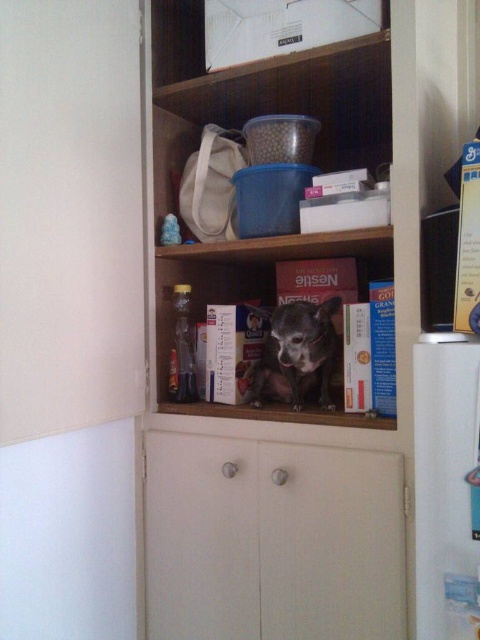
Question: Which object appears farthest from the camera in this image?

Choices:
 (A) wooden bookshelf at upper center
 (B) wooden shelf at center
 (C) fuzzy brown dog at center
 (D) white glossy refrigerator at right

Answer: (C)

Question: Which object appears farthest from the camera in this image?

Choices:
 (A) white glossy refrigerator at right
 (B) white matte cabinet at lower center

Answer: (B)

Question: From the image, what is the correct spatial relationship of white matte cabinet at lower center in relation to fuzzy brown dog at center?

Choices:
 (A) above
 (B) below

Answer: (B)

Question: Which object is farther from the camera taking this photo?

Choices:
 (A) white glossy refrigerator at right
 (B) white matte cabinet at lower center
 (C) wooden shelf at center

Answer: (C)

Question: Is wooden bookshelf at upper center below fuzzy brown dog at center?

Choices:
 (A) no
 (B) yes

Answer: (A)

Question: Is wooden bookshelf at upper center to the left of wooden shelf at center from the viewer's perspective?

Choices:
 (A) yes
 (B) no

Answer: (B)